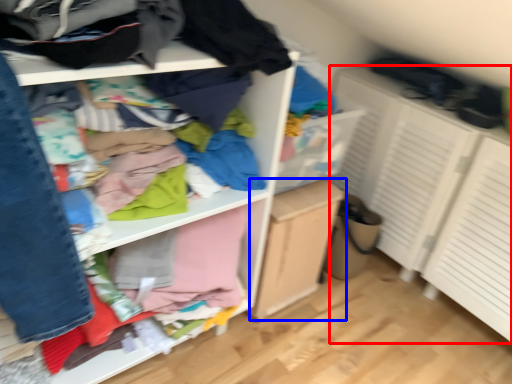
Question: Which object is closer to the camera taking this photo, cabinetry (highlighted by a red box) or file cabinet (highlighted by a blue box)?

Choices:
 (A) cabinetry
 (B) file cabinet

Answer: (A)